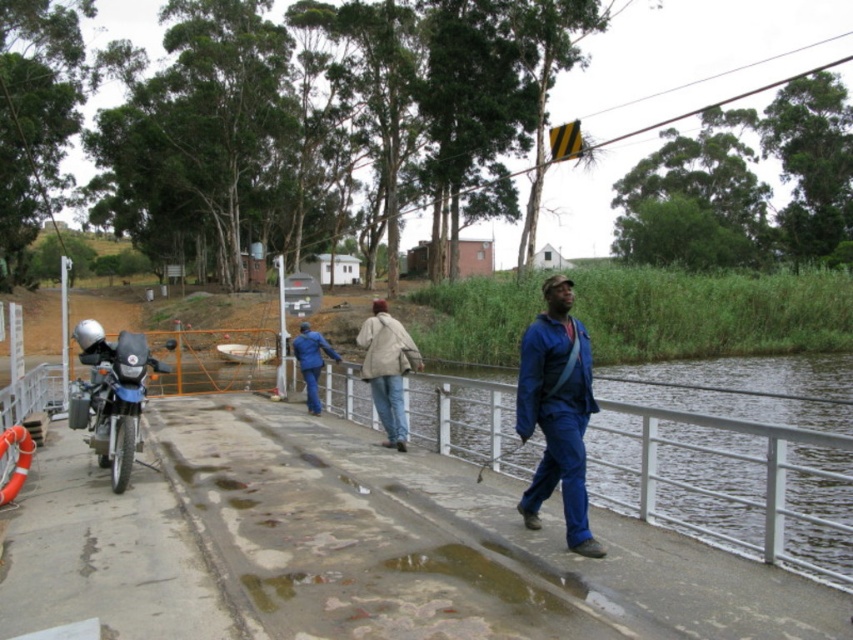
Does beige fabric jacket at center lie in front of blue fabric jacket at center?

Yes, beige fabric jacket at center is in front of blue fabric jacket at center.

Is point (397, 372) positioned before point (300, 372)?

Yes, it is.

Image resolution: width=853 pixels, height=640 pixels. I want to click on beige fabric jacket at center, so click(x=387, y=369).

Between point (567, 436) and point (309, 364), which one is positioned behind?

The point (309, 364) is behind.

Measure the distance between blue matte jumpsuit at center and camera.

blue matte jumpsuit at center and camera are 5.39 meters apart from each other.

Is point (592, 404) closer to camera compared to point (305, 362)?

Yes.

Where is `blue matte jumpsuit at center`? The height and width of the screenshot is (640, 853). blue matte jumpsuit at center is located at coordinates (556, 412).

Which of these two, matte black motorcycle at left or blue fabric jacket at center, stands shorter?

Standing shorter between the two is blue fabric jacket at center.

Does matte black motorcycle at left have a greater height compared to blue fabric jacket at center?

Correct, matte black motorcycle at left is much taller as blue fabric jacket at center.

Where is `matte black motorcycle at left`? The height and width of the screenshot is (640, 853). matte black motorcycle at left is located at coordinates (112, 396).